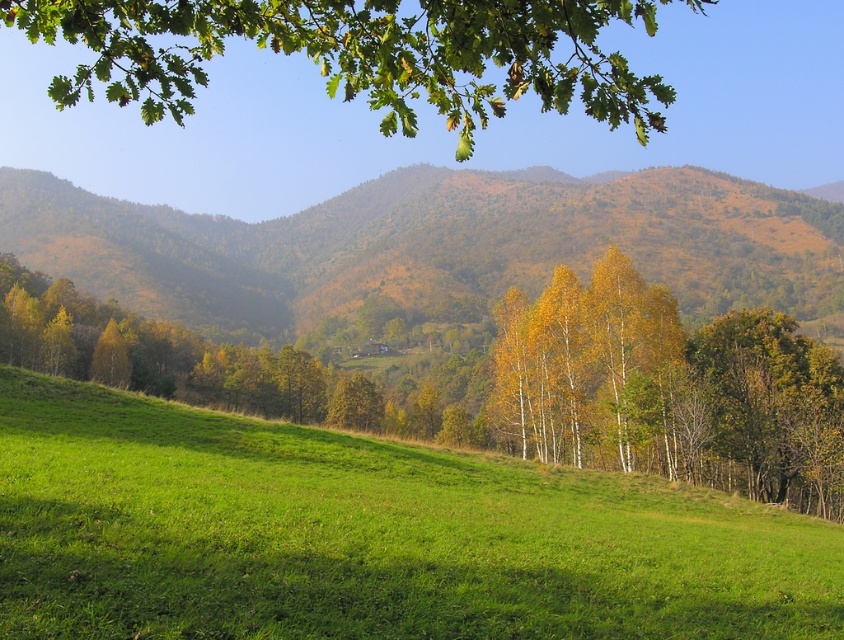
Question: Estimate the real-world distances between objects in this image. Which object is farther from the green leafy branch at upper center?

Choices:
 (A) yellow-green leaves at center
 (B) brown/wooden/mountain at center
 (C) green grassy hillside at lower center

Answer: (B)

Question: Which of the following is the closest to the observer?

Choices:
 (A) green grassy hillside at lower center
 (B) green leafy branch at upper center
 (C) yellow-green leaves at center
 (D) brown/wooden/mountain at center

Answer: (A)

Question: Is brown/wooden/mountain at center to the left of yellow-green leaves at center from the viewer's perspective?

Choices:
 (A) no
 (B) yes

Answer: (A)

Question: Is brown/wooden/mountain at center smaller than yellow-green leaves at center?

Choices:
 (A) yes
 (B) no

Answer: (B)

Question: Is brown/wooden/mountain at center positioned before green leafy branch at upper center?

Choices:
 (A) no
 (B) yes

Answer: (A)

Question: Which of the following is the farthest from the observer?

Choices:
 (A) (606, 72)
 (B) (295, 353)
 (C) (619, 182)
 (D) (540, 612)

Answer: (C)